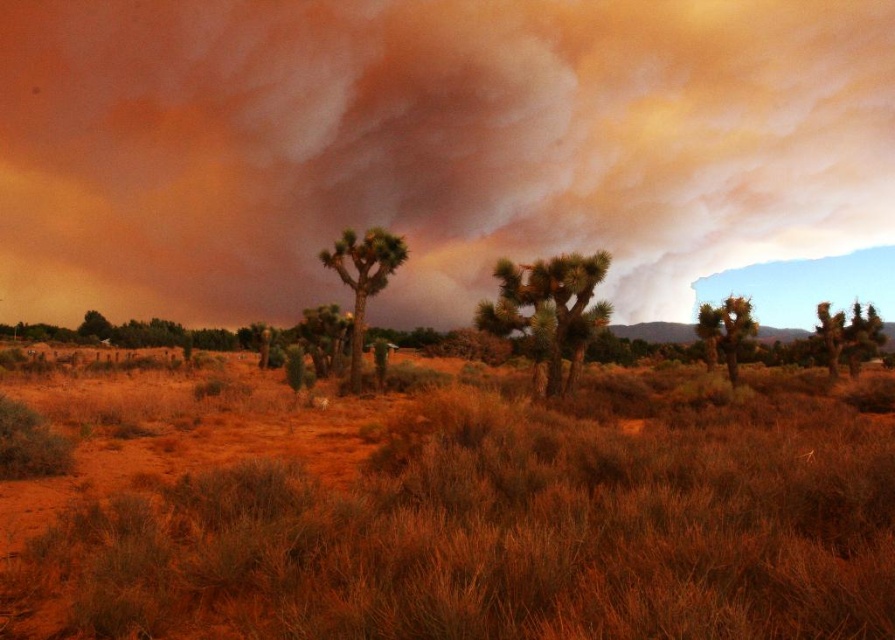
Is brown grass at center bigger than green textured tree at center?

Yes.

Which of these two, brown grass at center or green textured tree at center, stands taller?

green textured tree at center

Where is `brown grass at center`? brown grass at center is located at coordinates (452, 509).

Looking at this image, who is positioned more to the left, brown textured cloud at upper center or brown textured joshua tree at center?

Positioned to the left is brown textured cloud at upper center.

Who is lower down, brown textured cloud at upper center or brown textured joshua tree at center?

Positioned lower is brown textured joshua tree at center.

Is point (37, 10) farther from viewer compared to point (568, 260)?

Yes, it is.

At what (x,y) coordinates should I click in order to perform the action: click on brown textured cloud at upper center. Please return your answer as a coordinate pair (x, y). Looking at the image, I should click on pyautogui.click(x=429, y=147).

Which is in front, point (640, 29) or point (363, 280)?

Point (363, 280)

Locate an element on the screen. brown textured cloud at upper center is located at coordinates (429, 147).

Find the location of `brown textured cloud at upper center`. brown textured cloud at upper center is located at coordinates pos(429,147).